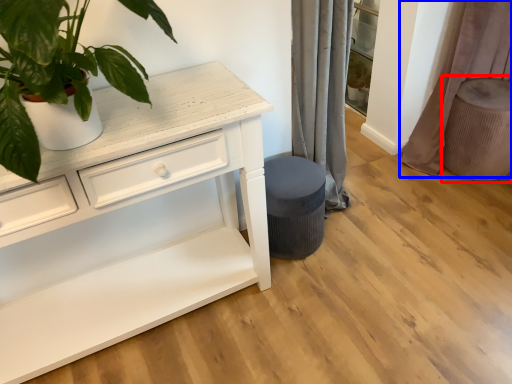
Question: Which of the following is the closest to the observer, swivel chair (highlighted by a red box) or curtain (highlighted by a blue box)?

Choices:
 (A) swivel chair
 (B) curtain

Answer: (B)